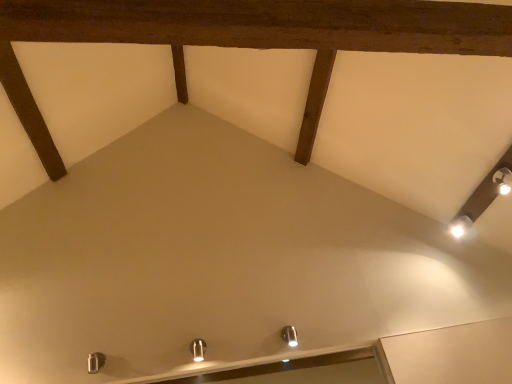
Measure the distance between point [459,227] and camera.

Point [459,227] is 9.19 feet from camera.

The height and width of the screenshot is (384, 512). Describe the element at coordinates (289, 336) in the screenshot. I see `satin nickel light fixture at lower center, arranged as the 2th light fixture when viewed from the back` at that location.

Locate an element on the screen. metallic silver light fixture at center, which is the 3th light fixture from right to left is located at coordinates (198, 349).

What do you see at coordinates (198, 349) in the screenshot? I see `metallic silver light fixture at center, which is the 3th light fixture from right to left` at bounding box center [198, 349].

Where is `white glossy light fixture at upper right, which is counted as the 3th light fixture, starting from the front`? This screenshot has width=512, height=384. white glossy light fixture at upper right, which is counted as the 3th light fixture, starting from the front is located at coordinates (462, 228).

Are metallic silver light fixture at center, positioned as the third light fixture in top-to-bottom order, and white glossy light fixture at upper right, the 3th light fixture in the bottom-to-top sequence, beside each other?

No, metallic silver light fixture at center, positioned as the third light fixture in top-to-bottom order, is not in contact with white glossy light fixture at upper right, the 3th light fixture in the bottom-to-top sequence.

Does metallic silver light fixture at center, marked as the third light fixture in a back-to-front arrangement, have a greater height compared to white glossy light fixture at upper right, which is the first light fixture from right to left?

Yes.

Does metallic silver light fixture at center, the 1th light fixture when ordered from left to right, come in front of white glossy light fixture at upper right, the 3th light fixture in the bottom-to-top sequence?

Yes, the depth of metallic silver light fixture at center, the 1th light fixture when ordered from left to right, is less than that of white glossy light fixture at upper right, the 3th light fixture in the bottom-to-top sequence.

What's the angular difference between metallic silver light fixture at center, positioned as the third light fixture in top-to-bottom order, and white glossy light fixture at upper right, the 3th light fixture in the bottom-to-top sequence,'s facing directions?

They differ by 93.7 degrees in their facing directions.

Which object is thinner, white glossy light fixture at upper right, the third light fixture in the left-to-right sequence, or satin nickel light fixture at lower center, arranged as the 2th light fixture when viewed from the back?

Thinner between the two is satin nickel light fixture at lower center, arranged as the 2th light fixture when viewed from the back.

Is white glossy light fixture at upper right, marked as the 1th light fixture in a top-to-bottom arrangement, situated inside satin nickel light fixture at lower center, the second light fixture when ordered from front to back, or outside?

white glossy light fixture at upper right, marked as the 1th light fixture in a top-to-bottom arrangement, lies outside satin nickel light fixture at lower center, the second light fixture when ordered from front to back.

From the image's perspective, which is above, white glossy light fixture at upper right, marked as the 1th light fixture in a top-to-bottom arrangement, or satin nickel light fixture at lower center, which ranks as the second light fixture in right-to-left order?

white glossy light fixture at upper right, marked as the 1th light fixture in a top-to-bottom arrangement, appears higher in the image.

I want to click on light fixture above the satin nickel light fixture at lower center, the second light fixture when ordered from front to back (from a real-world perspective), so click(x=462, y=228).

Does white glossy light fixture at upper right, which ranks as the 1th light fixture in back-to-front order, touch metallic silver light fixture at center, the 1th light fixture when ordered from left to right?

There is a gap between white glossy light fixture at upper right, which ranks as the 1th light fixture in back-to-front order, and metallic silver light fixture at center, the 1th light fixture when ordered from left to right.

Is white glossy light fixture at upper right, marked as the 1th light fixture in a top-to-bottom arrangement, aimed at metallic silver light fixture at center, the 1th light fixture when ordered from left to right?

Yes, white glossy light fixture at upper right, marked as the 1th light fixture in a top-to-bottom arrangement, is aimed at metallic silver light fixture at center, the 1th light fixture when ordered from left to right.

From a real-world perspective, which light fixture is the 2nd one above the metallic silver light fixture at center, which is the 3th light fixture from right to left? Please provide its 2D coordinates.

[(462, 228)]

Which is behind, white glossy light fixture at upper right, which ranks as the 1th light fixture in back-to-front order, or metallic silver light fixture at center, positioned as the third light fixture in top-to-bottom order?

white glossy light fixture at upper right, which ranks as the 1th light fixture in back-to-front order, is behind.

Would you say metallic silver light fixture at center, marked as the 1th light fixture in a bottom-to-top arrangement, is inside or outside satin nickel light fixture at lower center, arranged as the 2th light fixture when viewed from the back?

metallic silver light fixture at center, marked as the 1th light fixture in a bottom-to-top arrangement, is not inside satin nickel light fixture at lower center, arranged as the 2th light fixture when viewed from the back, it's outside.

Where is `light fixture below the satin nickel light fixture at lower center, which is the second light fixture from bottom to top (from the image's perspective)`? The width and height of the screenshot is (512, 384). light fixture below the satin nickel light fixture at lower center, which is the second light fixture from bottom to top (from the image's perspective) is located at coordinates 198,349.

Are metallic silver light fixture at center, positioned as the third light fixture in top-to-bottom order, and satin nickel light fixture at lower center, arranged as the 2th light fixture when viewed from the back, far apart?

They are positioned close to each other.

From the picture: Considering the sizes of objects metallic silver light fixture at center, which is the 3th light fixture from right to left, and satin nickel light fixture at lower center, which ranks as the second light fixture in right-to-left order, in the image provided, who is wider, metallic silver light fixture at center, which is the 3th light fixture from right to left, or satin nickel light fixture at lower center, which ranks as the second light fixture in right-to-left order,?

satin nickel light fixture at lower center, which ranks as the second light fixture in right-to-left order, is wider.

From a real-world perspective, is satin nickel light fixture at lower center, the second light fixture when ordered from front to back, located beneath metallic silver light fixture at center, placed as the first light fixture when sorted from front to back?

No.

Which is more to the left, satin nickel light fixture at lower center, the 2th light fixture from the top, or metallic silver light fixture at center, placed as the first light fixture when sorted from front to back?

metallic silver light fixture at center, placed as the first light fixture when sorted from front to back.

Is satin nickel light fixture at lower center, which ranks as the second light fixture in right-to-left order, shorter than metallic silver light fixture at center, placed as the first light fixture when sorted from front to back?

Correct, satin nickel light fixture at lower center, which ranks as the second light fixture in right-to-left order, is not as tall as metallic silver light fixture at center, placed as the first light fixture when sorted from front to back.

Is satin nickel light fixture at lower center, arranged as the 2th light fixture when viewed from the back, oriented away from metallic silver light fixture at center, placed as the first light fixture when sorted from front to back?

No, satin nickel light fixture at lower center, arranged as the 2th light fixture when viewed from the back, is not facing the opposite direction of metallic silver light fixture at center, placed as the first light fixture when sorted from front to back.

Considering the sizes of objects satin nickel light fixture at lower center, the 2th light fixture from the top, and white glossy light fixture at upper right, marked as the 1th light fixture in a top-to-bottom arrangement, in the image provided, who is taller, satin nickel light fixture at lower center, the 2th light fixture from the top, or white glossy light fixture at upper right, marked as the 1th light fixture in a top-to-bottom arrangement,?

satin nickel light fixture at lower center, the 2th light fixture from the top, is taller.

Is satin nickel light fixture at lower center, arranged as the 2th light fixture when viewed from the back, oriented away from white glossy light fixture at upper right, marked as the 1th light fixture in a top-to-bottom arrangement?

No, satin nickel light fixture at lower center, arranged as the 2th light fixture when viewed from the back, is not facing away from white glossy light fixture at upper right, marked as the 1th light fixture in a top-to-bottom arrangement.

From the image's perspective, relative to white glossy light fixture at upper right, marked as the 1th light fixture in a top-to-bottom arrangement, is satin nickel light fixture at lower center, arranged as the 2th light fixture when viewed from the back, above or below?

From the image's perspective, satin nickel light fixture at lower center, arranged as the 2th light fixture when viewed from the back, appears below white glossy light fixture at upper right, marked as the 1th light fixture in a top-to-bottom arrangement.

Considering their positions, is satin nickel light fixture at lower center, which is the second light fixture from bottom to top, located in front of or behind white glossy light fixture at upper right, the third light fixture in the left-to-right sequence?

Clearly, satin nickel light fixture at lower center, which is the second light fixture from bottom to top, is in front of white glossy light fixture at upper right, the third light fixture in the left-to-right sequence.

From a real-world perspective, which light fixture is the 2nd one above the metallic silver light fixture at center, the 1th light fixture when ordered from left to right? Please provide its 2D coordinates.

[(462, 228)]

Starting from the white glossy light fixture at upper right, the 3th light fixture in the bottom-to-top sequence, which light fixture is the 1st one in front? Please provide its 2D coordinates.

[(289, 336)]

Looking at the image, which one is located closer to metallic silver light fixture at center, marked as the 1th light fixture in a bottom-to-top arrangement, satin nickel light fixture at lower center, the second light fixture when ordered from front to back, or white glossy light fixture at upper right, which ranks as the 1th light fixture in back-to-front order?

satin nickel light fixture at lower center, the second light fixture when ordered from front to back, lies closer to metallic silver light fixture at center, marked as the 1th light fixture in a bottom-to-top arrangement, than the other object.

Looking at the image, which one is located further to satin nickel light fixture at lower center, the 2th light fixture from the top, white glossy light fixture at upper right, which ranks as the 1th light fixture in back-to-front order, or metallic silver light fixture at center, the 1th light fixture when ordered from left to right?

white glossy light fixture at upper right, which ranks as the 1th light fixture in back-to-front order, is further to satin nickel light fixture at lower center, the 2th light fixture from the top.

From the image, which object appears to be nearer to satin nickel light fixture at lower center, arranged as the 2th light fixture when viewed from the back, metallic silver light fixture at center, which is the 3th light fixture from right to left, or white glossy light fixture at upper right, the third light fixture in the left-to-right sequence?

The object closer to satin nickel light fixture at lower center, arranged as the 2th light fixture when viewed from the back, is metallic silver light fixture at center, which is the 3th light fixture from right to left.

Considering their positions, is metallic silver light fixture at center, placed as the first light fixture when sorted from front to back, positioned further to white glossy light fixture at upper right, which ranks as the 1th light fixture in back-to-front order, than satin nickel light fixture at lower center, which is the second light fixture from bottom to top?

metallic silver light fixture at center, placed as the first light fixture when sorted from front to back, lies further to white glossy light fixture at upper right, which ranks as the 1th light fixture in back-to-front order, than the other object.

Looking at the image, which one is located closer to white glossy light fixture at upper right, which is counted as the 3th light fixture, starting from the front, satin nickel light fixture at lower center, the 2th light fixture from the top, or metallic silver light fixture at center, which is the 3th light fixture from right to left?

satin nickel light fixture at lower center, the 2th light fixture from the top, is closer to white glossy light fixture at upper right, which is counted as the 3th light fixture, starting from the front.

Which object lies nearer to the anchor point metallic silver light fixture at center, marked as the 1th light fixture in a bottom-to-top arrangement, white glossy light fixture at upper right, which is counted as the 3th light fixture, starting from the front, or satin nickel light fixture at lower center, which is the second light fixture from bottom to top?

Among the two, satin nickel light fixture at lower center, which is the second light fixture from bottom to top, is located nearer to metallic silver light fixture at center, marked as the 1th light fixture in a bottom-to-top arrangement.

At what (x,y) coordinates should I click in order to perform the action: click on light fixture between metallic silver light fixture at center, positioned as the third light fixture in top-to-bottom order, and white glossy light fixture at upper right, marked as the 1th light fixture in a top-to-bottom arrangement, from left to right. Please return your answer as a coordinate pair (x, y). The width and height of the screenshot is (512, 384). Looking at the image, I should click on (289, 336).